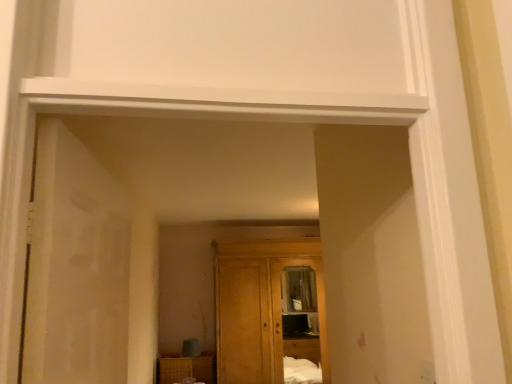
Question: Is woven wood cabinet at lower center wider than wooden wardrobe at center?

Choices:
 (A) yes
 (B) no

Answer: (B)

Question: Considering the relative positions of woven wood cabinet at lower center and wooden wardrobe at center in the image provided, is woven wood cabinet at lower center in front of wooden wardrobe at center?

Choices:
 (A) no
 (B) yes

Answer: (A)

Question: Considering the relative sizes of woven wood cabinet at lower center and wooden wardrobe at center in the image provided, is woven wood cabinet at lower center bigger than wooden wardrobe at center?

Choices:
 (A) yes
 (B) no

Answer: (B)

Question: Can you confirm if woven wood cabinet at lower center is smaller than wooden wardrobe at center?

Choices:
 (A) no
 (B) yes

Answer: (B)

Question: From the image's perspective, would you say woven wood cabinet at lower center is positioned over wooden wardrobe at center?

Choices:
 (A) yes
 (B) no

Answer: (B)

Question: Is woven wood cabinet at lower center at the right side of wooden wardrobe at center?

Choices:
 (A) no
 (B) yes

Answer: (A)

Question: Considering the relative sizes of wooden wardrobe at center and white matte door at left in the image provided, is wooden wardrobe at center smaller than white matte door at left?

Choices:
 (A) yes
 (B) no

Answer: (B)

Question: Is there a large distance between wooden wardrobe at center and white matte door at left?

Choices:
 (A) no
 (B) yes

Answer: (B)

Question: From a real-world perspective, is wooden wardrobe at center on top of white matte door at left?

Choices:
 (A) no
 (B) yes

Answer: (A)

Question: Could white matte door at left be considered to be inside wooden wardrobe at center?

Choices:
 (A) no
 (B) yes

Answer: (A)

Question: From the image's perspective, is wooden wardrobe at center under white matte door at left?

Choices:
 (A) yes
 (B) no

Answer: (A)

Question: Is wooden wardrobe at center taller than white matte door at left?

Choices:
 (A) yes
 (B) no

Answer: (A)

Question: Is white matte door at left positioned in front of woven wood cabinet at lower center?

Choices:
 (A) no
 (B) yes

Answer: (B)